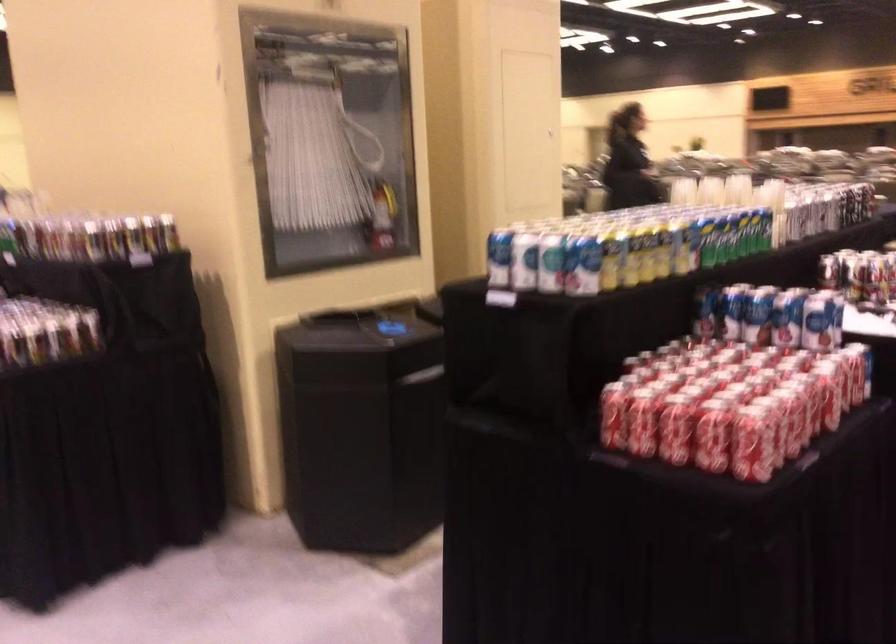
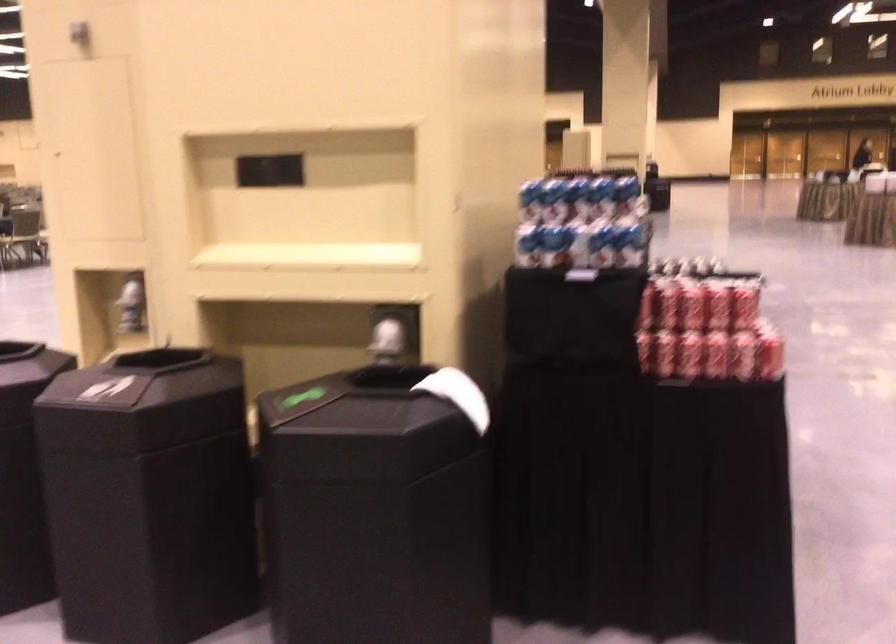
Question: I am providing you with two images of the same scene from different viewpoints. Which of the following objects are not visible in image2?

Choices:
 (A) blue and white can
 (B) white access panel handle
 (C) white paper towel
 (D) red soda can

Answer: (A)